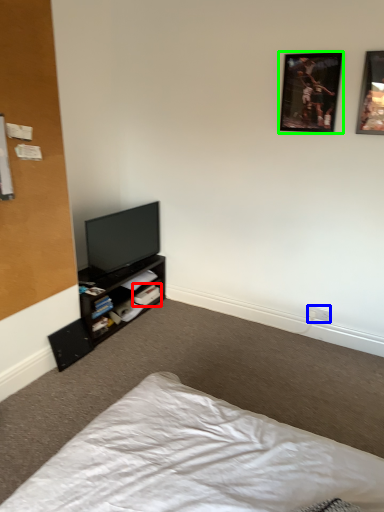
Question: Estimate the real-world distances between objects in this image. Which object is farther from book (highlighted by a red box), electric outlet (highlighted by a blue box) or picture frame (highlighted by a green box)?

Choices:
 (A) electric outlet
 (B) picture frame

Answer: (B)